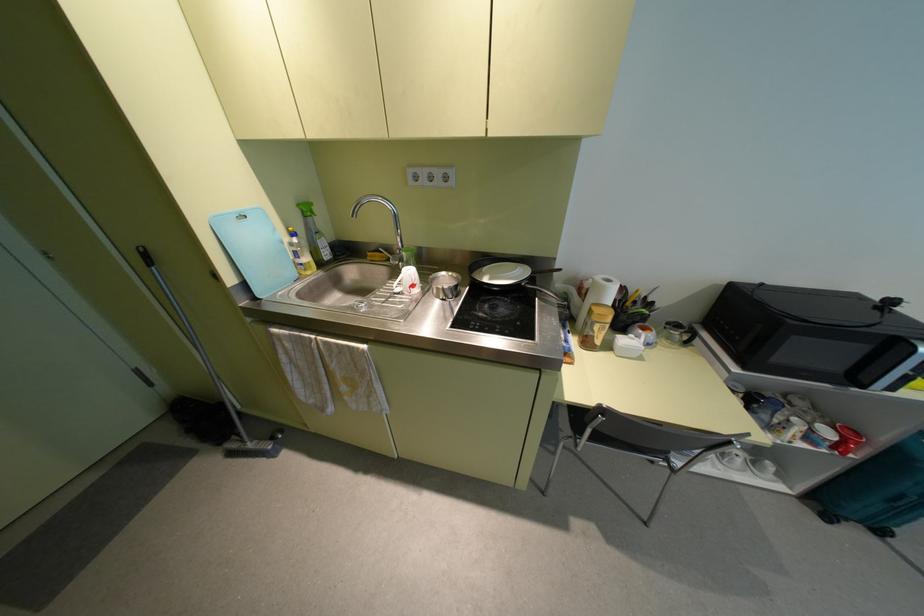
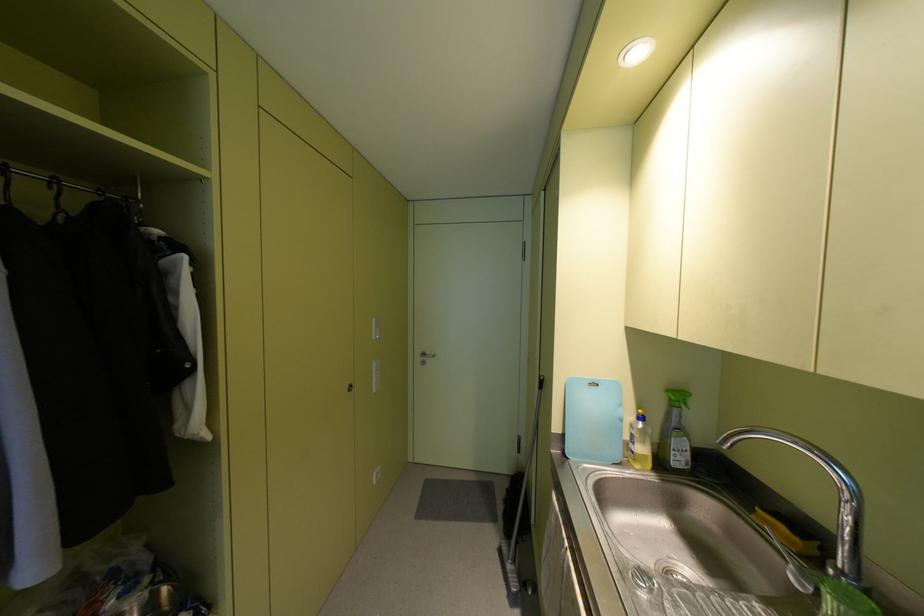
Question: The camera is either moving clockwise (left) or counter-clockwise (right) around the object. The first image is from the beginning of the video and the second image is from the end. Is the camera moving left or right when shooting the video?

Choices:
 (A) Left
 (B) Right

Answer: (B)